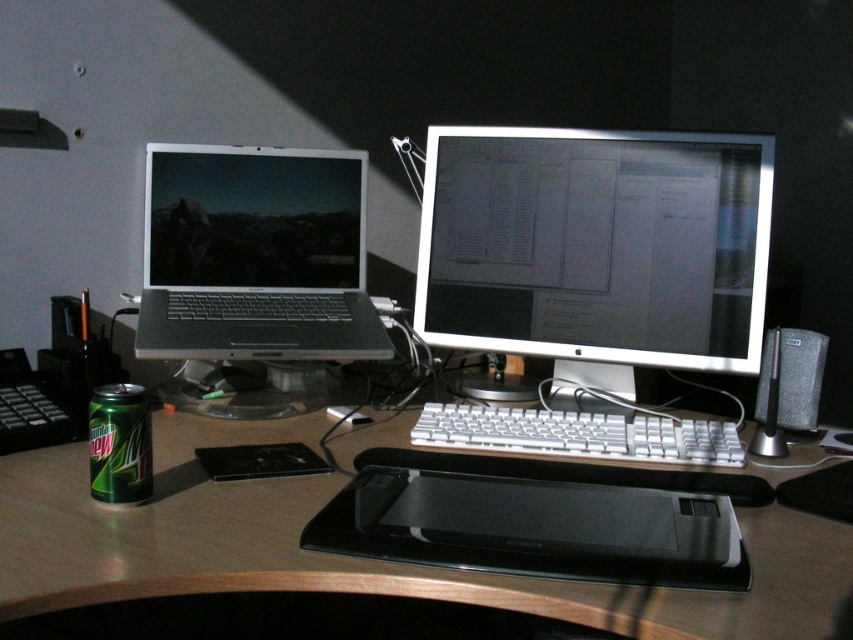
Which is in front, point (428, 188) or point (842, 611)?

Point (842, 611)

In the scene shown: Measure the distance between satin silver monitor at center and camera.

The distance of satin silver monitor at center from camera is 3.99 feet.

Does point (720, 348) come in front of point (531, 580)?

No, it is behind (531, 580).

Image resolution: width=853 pixels, height=640 pixels. In order to click on satin silver monitor at center in this screenshot , I will do `click(596, 248)`.

Which of these two, brown wood table at center or white plastic keyboard at center, stands taller?

With more height is brown wood table at center.

Does brown wood table at center appear over white plastic keyboard at center?

Incorrect, brown wood table at center is not positioned above white plastic keyboard at center.

Is point (161, 504) behind point (627, 451)?

No, it is in front of (627, 451).

Where is `brown wood table at center`? The image size is (853, 640). brown wood table at center is located at coordinates (352, 557).

Which is more to the right, black matte speaker at right or green matte can at lower left?

black matte speaker at right

Does black matte speaker at right have a greater height compared to green matte can at lower left?

Indeed, black matte speaker at right has a greater height compared to green matte can at lower left.

Which is in front, point (763, 419) or point (123, 486)?

Point (123, 486) is more forward.

Image resolution: width=853 pixels, height=640 pixels. Find the location of `black matte speaker at right`. black matte speaker at right is located at coordinates (787, 388).